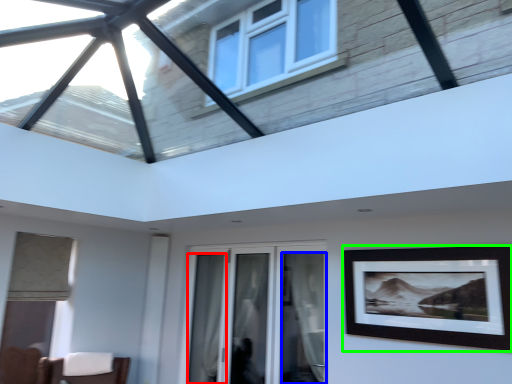
Question: Which object is the farthest from curtain (highlighted by a red box)? Choose among these: curtain (highlighted by a blue box) or picture frame (highlighted by a green box).

Choices:
 (A) curtain
 (B) picture frame

Answer: (B)